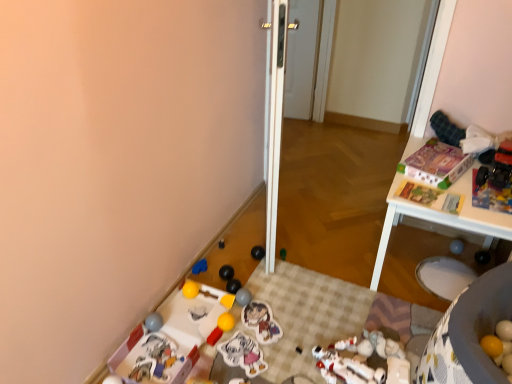
What are the coordinates of `vacant area that lies between plastic toy car at lower left, the 2th toy positioned from the left, and matte gray ball at center, marked as the tenth toy in a left-to-right arrangement` in the screenshot? It's located at (204, 322).